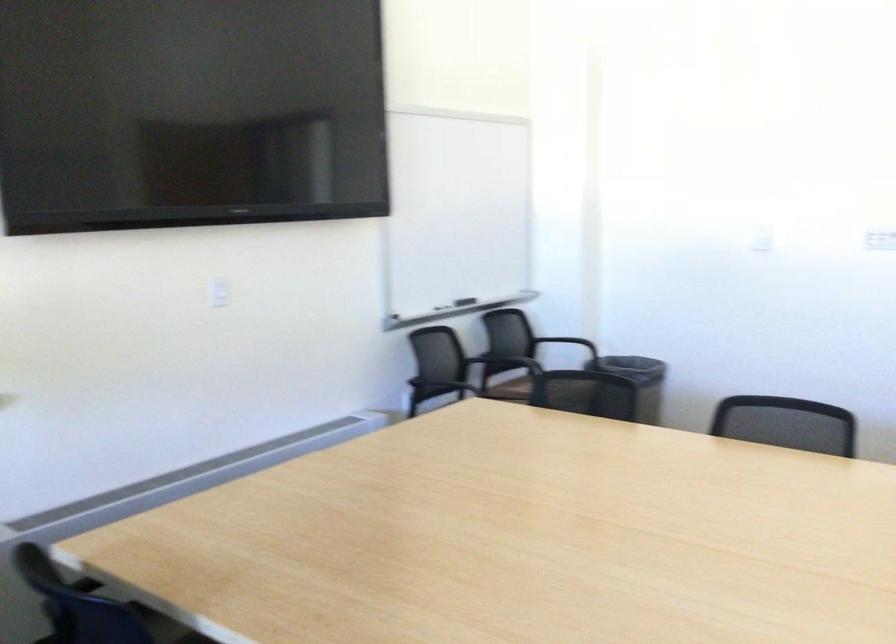
The images are taken continuously from a first-person perspective. In which direction is your viewpoint rotating?

The rotation direction of the camera is right-down.